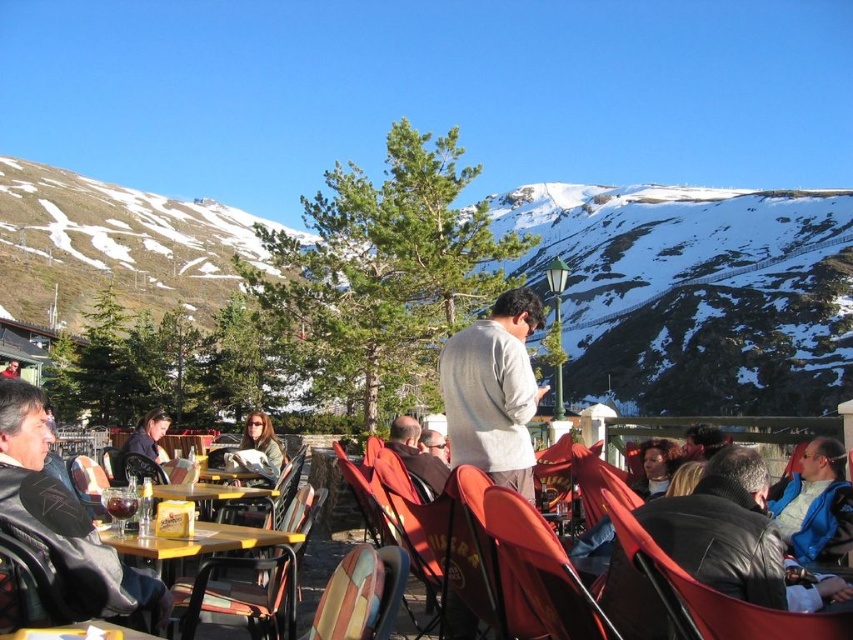
Can you confirm if snowy rock at upper center is positioned to the right of brown leather jacket at center?

In fact, snowy rock at upper center is to the left of brown leather jacket at center.

Which is more to the right, snowy rock at upper center or brown leather jacket at center?

brown leather jacket at center

I want to click on snowy rock at upper center, so click(x=695, y=292).

Is leather jacket at lower left thinner than metallic silver chair at lower left?

No.

From the picture: Measure the distance between leather jacket at lower left and metallic silver chair at lower left.

The distance of leather jacket at lower left from metallic silver chair at lower left is 6.96 meters.

Who is more distant from viewer, (91, 609) or (274, 634)?

The point (274, 634) is behind.

Find the location of `leather jacket at lower left`. leather jacket at lower left is located at coordinates (62, 518).

Is leather jacket at lower left bigger than brown leather jacket at center?

Yes, leather jacket at lower left is bigger than brown leather jacket at center.

Which is behind, point (15, 424) or point (397, 429)?

The point (397, 429) is more distant.

Find the location of `leather jacket at lower left`. leather jacket at lower left is located at coordinates (62, 518).